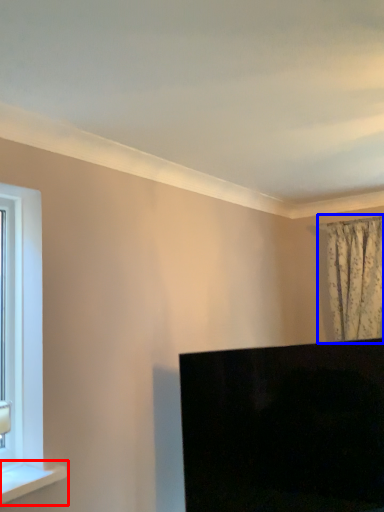
Question: Which object appears farthest to the camera in this image, window sill (highlighted by a red box) or curtain (highlighted by a blue box)?

Choices:
 (A) window sill
 (B) curtain

Answer: (B)